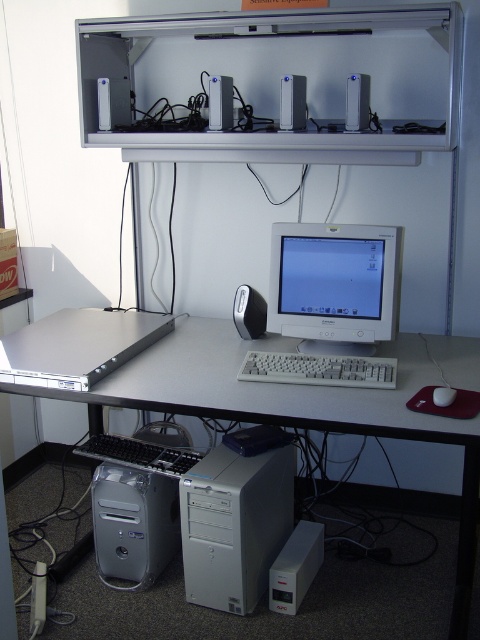
Based on the photo, what object is located at the coordinates point [235,524] in the workspace setup?

The point [235,524] marks the white plastic computer tower at center.

What object is located at the coordinates point (139,454) in the workspace setup?

The point (139,454) indicates the location of the black plastic keyboard at lower center.

You are organizing the workspace and need to place a new item between the white plastic computer desk at center and the black plastic keyboard at lower center. Is there enough vertical space between them to fit a 10cm tall object?

The white plastic computer desk at center is located above the black plastic keyboard at lower center, but the exact vertical distance isnot provided. Without knowing the distance, it is impossible to determine if a 10cm tall object can fit between them.